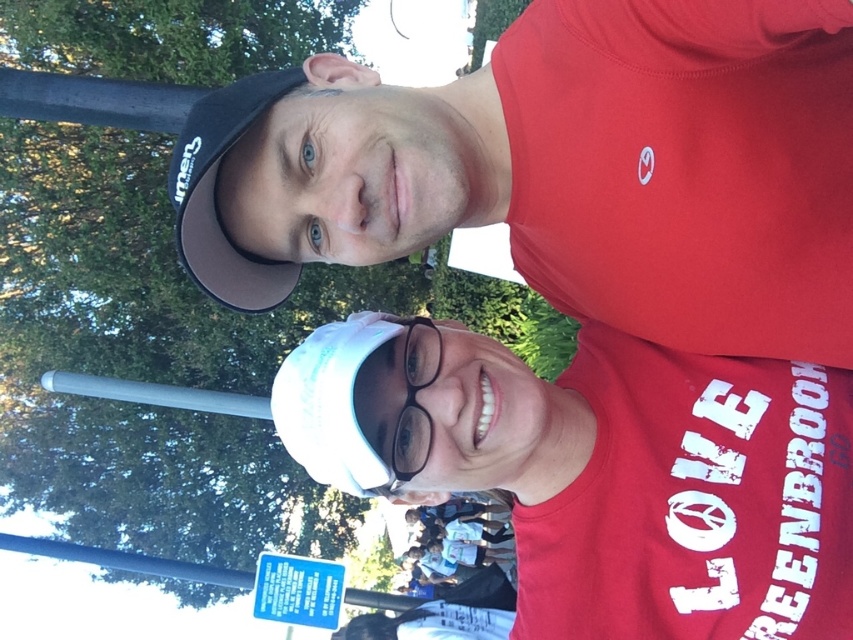
You are a photographer trying to capture a clear shot of the transparent plastic glasses at center. However, the white matte cap at upper center is blocking your view. Can you adjust your angle to see the glasses without moving the subjects?

The white matte cap at upper center is positioned over transparent plastic glasses at center, so adjusting your angle downward might allow you to see the glasses without moving the subjects.

You are a photographer at a park event. You notice a person wearing a black matte baseball cap at upper left and another wearing transparent plastic glasses at center. Which object is covering the other?

The black matte baseball cap at upper left is positioned over the transparent plastic glasses at center, so it is covering the glasses.

You are a photographer trying to capture a clear shot of both the white matte cap at upper center and the transparent plastic glasses at center. Given that your camera has a minimum focus distance of 12 inches, will you be able to focus on both objects simultaneously?

The white matte cap at upper center and transparent plastic glasses at center are 12.89 inches apart. Since the distance between them is greater than the camera minimum focus distance of 12 inches, the camera can focus on both objects simultaneously.